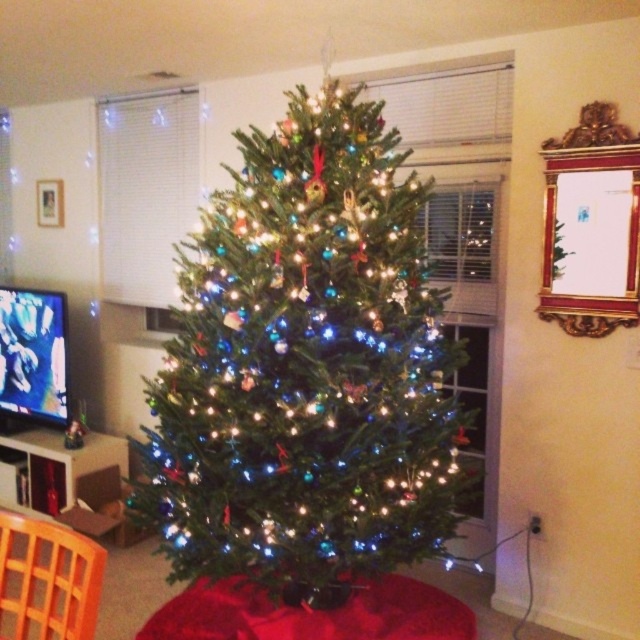
Question: Which of the following is the closest to the observer?

Choices:
 (A) green matte christmas tree at center
 (B) orange plastic chair at lower left

Answer: (B)

Question: Is green matte christmas tree at center in front of orange plastic chair at lower left?

Choices:
 (A) no
 (B) yes

Answer: (A)

Question: Does green matte christmas tree at center have a smaller size compared to orange plastic chair at lower left?

Choices:
 (A) no
 (B) yes

Answer: (A)

Question: Which point is farther from the camera taking this photo?

Choices:
 (A) (81, 620)
 (B) (360, 376)

Answer: (B)

Question: Can you confirm if green matte christmas tree at center is positioned above orange plastic chair at lower left?

Choices:
 (A) yes
 (B) no

Answer: (A)